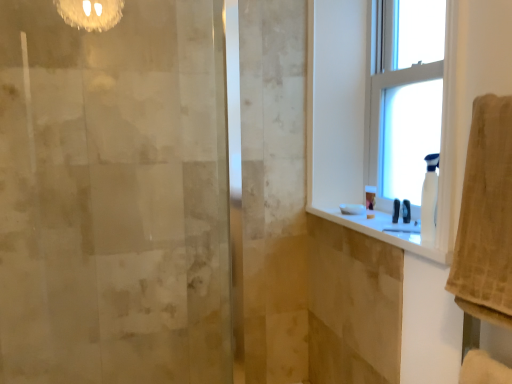
I want to click on vacant space in white plastic window at upper right, which is the first window in left-to-right order (from a real-world perspective), so [x=373, y=233].